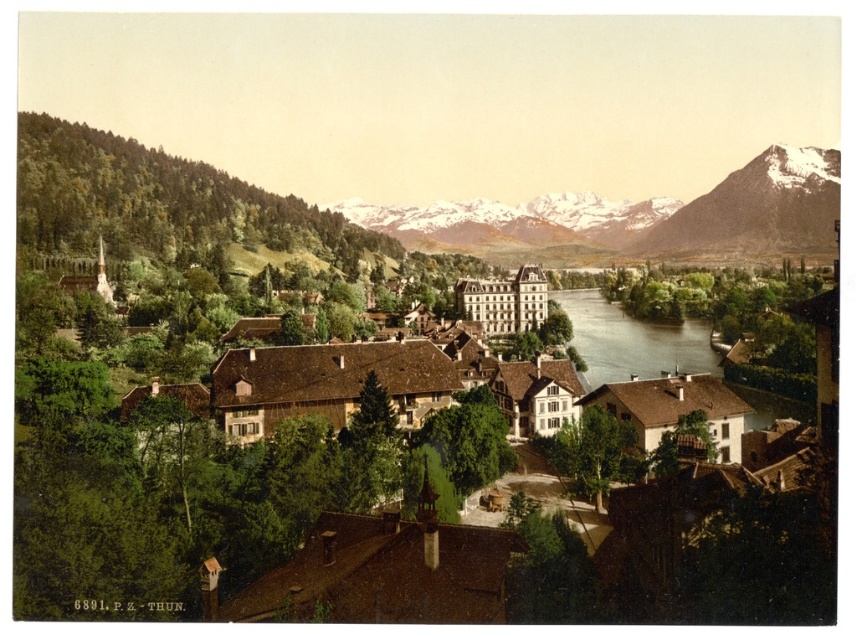
Question: Which point is farther from the camera taking this photo?

Choices:
 (A) (548, 253)
 (B) (664, 362)

Answer: (A)

Question: Where is snowy granite mountain at upper center located in relation to brown water at center in the image?

Choices:
 (A) below
 (B) above

Answer: (B)

Question: Estimate the real-world distances between objects in this image. Which object is farther from the brown water at center?

Choices:
 (A) snowy granite mountain at upper right
 (B) snowy granite mountain at upper center

Answer: (B)

Question: Is snowy granite mountain at upper right positioned at the back of brown water at center?

Choices:
 (A) no
 (B) yes

Answer: (B)

Question: Does snowy granite mountain at upper center appear on the right side of brown water at center?

Choices:
 (A) yes
 (B) no

Answer: (A)

Question: Based on their relative distances, which object is nearer to the brown water at center?

Choices:
 (A) snowy granite mountain at upper center
 (B) snowy granite mountain at upper right

Answer: (B)